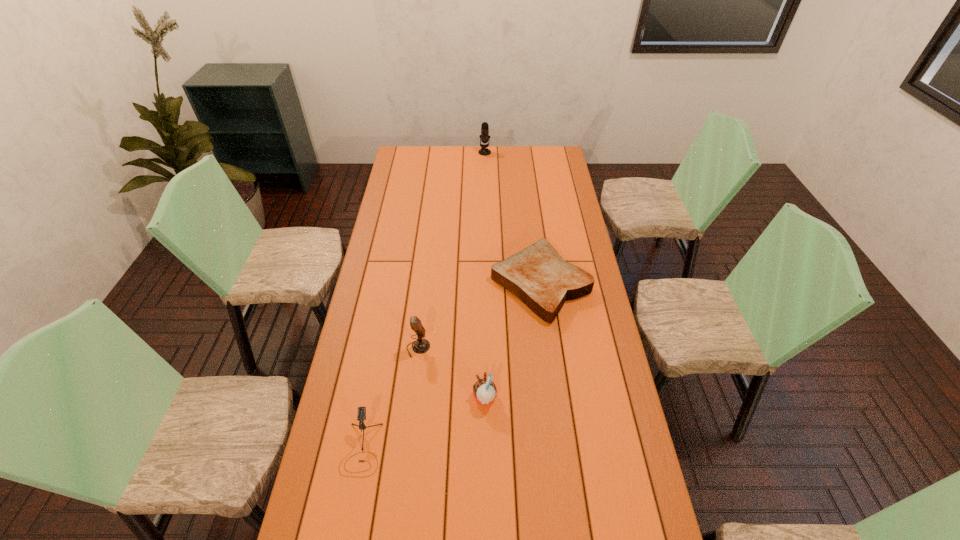
Find the location of a particular element. The width and height of the screenshot is (960, 540). free location at the left edge of the desktop is located at coordinates (414, 230).

Image resolution: width=960 pixels, height=540 pixels. In the image, there is a desktop. Find the location of `free space at the right edge`. free space at the right edge is located at coordinates (566, 204).

This screenshot has width=960, height=540. Identify the location of vacant space at the far right corner of the desktop. (544, 151).

The image size is (960, 540). Identify the location of free space between the second shortest microphone and the fourth farthest object. (451, 373).

Find the location of a particular element. The height and width of the screenshot is (540, 960). vacant region between the farthest object and the nearest microphone is located at coordinates (423, 300).

Where is `blank region between the nearest microphone and the muffin`? This screenshot has height=540, width=960. blank region between the nearest microphone and the muffin is located at coordinates (423, 423).

You are a GUI agent. You are given a task and a screenshot of the screen. Output one action in this format:
    pyautogui.click(x=<x>, y=<y>)
    Task: Click on the vacant space that is in between the nearest microphone and the shortest object
    The image size is (960, 540).
    Given the screenshot: What is the action you would take?
    pyautogui.click(x=451, y=366)

At what (x,y) coordinates should I click in order to perform the action: click on free space between the fourth shortest object and the farthest microphone. Please return your answer as a coordinate pair (x, y). Image resolution: width=960 pixels, height=540 pixels. Looking at the image, I should click on (451, 250).

Identify the location of unoccupied position between the shortest object and the farthest object. Image resolution: width=960 pixels, height=540 pixels. (513, 218).

Locate an element on the screen. The height and width of the screenshot is (540, 960). vacant space that is in between the leftmost microphone and the farthest microphone is located at coordinates (423, 300).